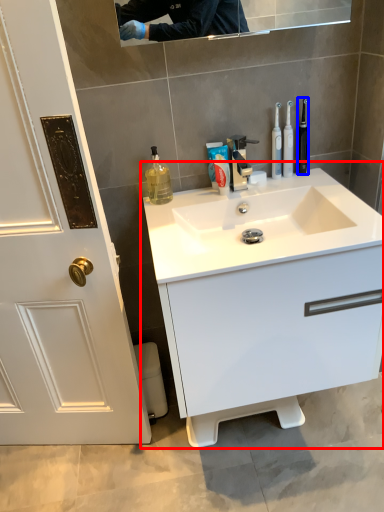
Question: Which object appears closest to the camera in this image, bathroom cabinet (highlighted by a red box) or toothbrush (highlighted by a blue box)?

Choices:
 (A) bathroom cabinet
 (B) toothbrush

Answer: (A)